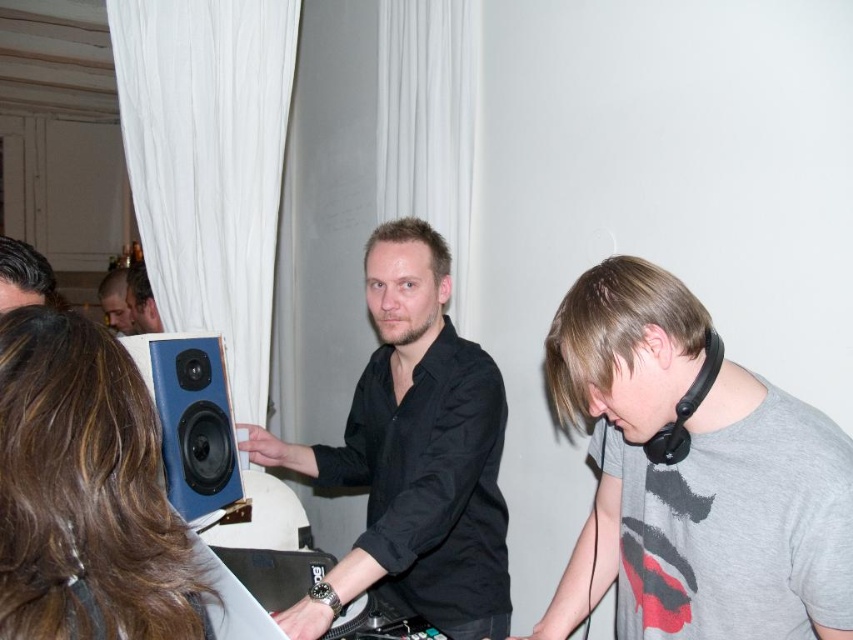
Question: Does black matte shirt at center have a larger size compared to blue matte speaker at left?

Choices:
 (A) no
 (B) yes

Answer: (B)

Question: Which point is farther from the camera taking this photo?

Choices:
 (A) (165, 406)
 (B) (138, 292)
 (C) (26, 282)
 (D) (477, 566)

Answer: (B)

Question: Considering the real-world distances, which object is closest to the black matte shirt at center?

Choices:
 (A) blue matte speaker at left
 (B) matte black headphones at upper left
 (C) gray matte t-shirt at center
 (D) matte black speaker at center

Answer: (A)

Question: Which point is closer to the camera?

Choices:
 (A) blue matte speaker at left
 (B) matte black headphones at upper left
 (C) gray matte t-shirt at center
 (D) matte black speaker at center

Answer: (C)

Question: Does gray matte t-shirt at center appear on the left side of black matte shirt at center?

Choices:
 (A) no
 (B) yes

Answer: (A)

Question: Does blue matte speaker at left appear on the left side of matte black headphones at upper left?

Choices:
 (A) no
 (B) yes

Answer: (A)